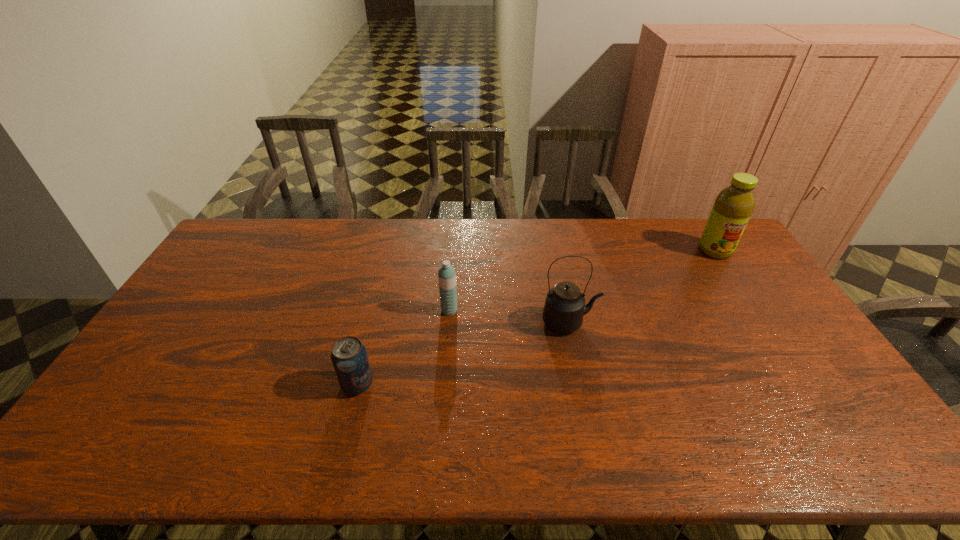
Find the location of a particular element. object identified as the third closest to the fruit juice is located at coordinates (349, 357).

Find the location of a particular element. Image resolution: width=960 pixels, height=540 pixels. free space that satisfies the following two spatial constraints: 1. on the back side of the third object from right to left; 2. on the right side of the nearest object is located at coordinates (376, 310).

I want to click on free space that satisfies the following two spatial constraints: 1. spout on the kettle; 2. on the front side of the leftmost object, so click(583, 384).

The image size is (960, 540). Find the location of `free location that satisfies the following two spatial constraints: 1. on the back side of the second shortest object; 2. on the left side of the nearest object`. free location that satisfies the following two spatial constraints: 1. on the back side of the second shortest object; 2. on the left side of the nearest object is located at coordinates (376, 310).